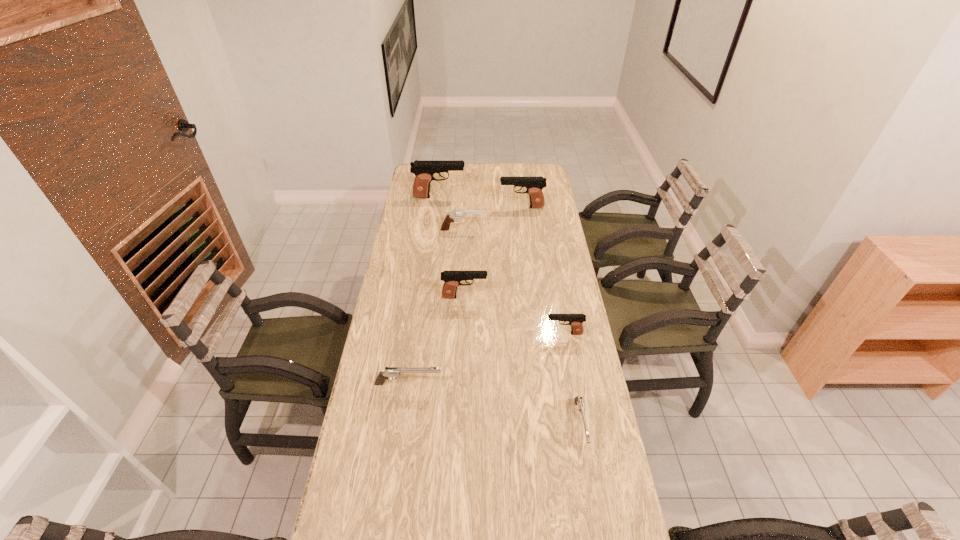
Locate an element on the screen. Image resolution: width=960 pixels, height=540 pixels. vacant space in between the left silver pistol and the third tallest pistol is located at coordinates (437, 340).

Find the location of a particular element. The image size is (960, 540). blank region between the shortest object and the gun is located at coordinates pyautogui.click(x=521, y=327).

Find the location of a particular element. blank region between the farthest black pistol and the third tallest object is located at coordinates (452, 247).

Identify the location of vacant region between the nearer silver pistol and the third biggest black pistol. (522, 361).

Locate which object is the fifth closest to the fifth nearest object. Please provide its 2D coordinates. Your answer should be formatted as a tuple, i.e. [(x, y)], where the tuple contains the x and y coordinates of a point satisfying the conditions above.

[(389, 372)]

At what (x,y) coordinates should I click in order to perform the action: click on object that is the fifth closest to the biggest black pistol. Please return your answer as a coordinate pair (x, y). The width and height of the screenshot is (960, 540). Looking at the image, I should click on (389, 372).

Find the location of a particular element. The width and height of the screenshot is (960, 540). pistol that stands as the closest to the sixth tallest object is located at coordinates (452, 279).

You are a GUI agent. You are given a task and a screenshot of the screen. Output one action in this format:
    pyautogui.click(x=<x>, y=<y>)
    Task: Click on the pistol that can be found as the fourth closest to the nearest black pistol
    
    Given the screenshot: What is the action you would take?
    pyautogui.click(x=534, y=185)

Identify which black pistol is the third closest to the farthest pistol. Please provide its 2D coordinates. Your answer should be formatted as a tuple, i.e. [(x, y)], where the tuple contains the x and y coordinates of a point satisfying the conditions above.

[(575, 321)]

This screenshot has height=540, width=960. Identify the location of black pistol that is the third closest to the nearest black pistol. (424, 170).